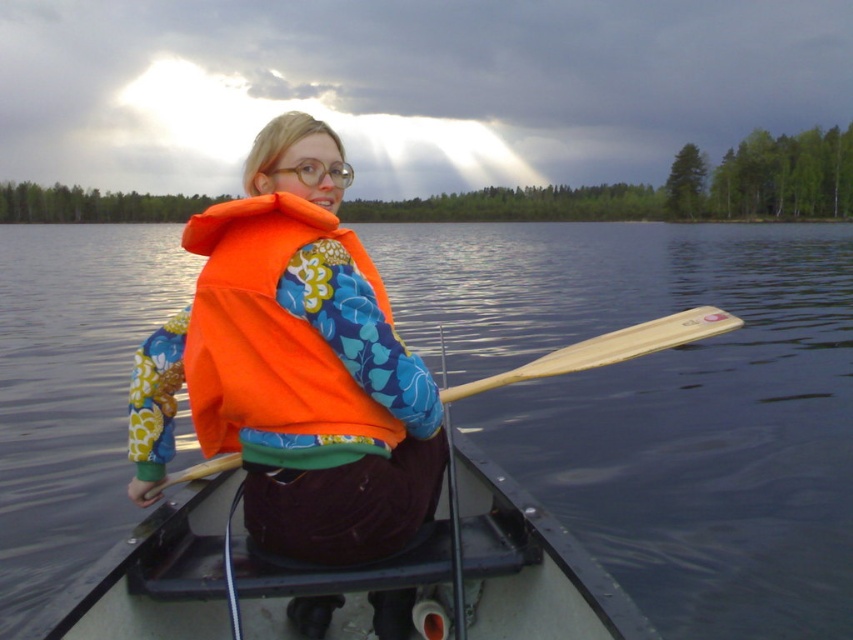
This screenshot has width=853, height=640. What do you see at coordinates (294, 365) in the screenshot?
I see `orange fabric life vest at center` at bounding box center [294, 365].

Who is positioned more to the left, orange fabric life vest at center or orange fleece life jacket at center?

From the viewer's perspective, orange fabric life vest at center appears more on the left side.

Is point (250, 173) behind point (248, 342)?

That is True.

At what (x,y) coordinates should I click in order to perform the action: click on orange fabric life vest at center. Please return your answer as a coordinate pair (x, y). This screenshot has height=640, width=853. Looking at the image, I should click on (294, 365).

Is point (254, 486) in front of point (462, 508)?

Yes.

Is orange fabric life vest at center below black plastic boat at center?

Actually, orange fabric life vest at center is above black plastic boat at center.

Between point (169, 451) and point (523, 522), which one is positioned in front?

Point (523, 522)

Where is `orange fabric life vest at center`? This screenshot has height=640, width=853. orange fabric life vest at center is located at coordinates (294, 365).

Can you confirm if transparent water at center is positioned to the left of black plastic boat at center?

Yes, transparent water at center is to the left of black plastic boat at center.

Is transparent water at center closer to camera compared to black plastic boat at center?

No, transparent water at center is behind black plastic boat at center.

Locate an element on the screen. The height and width of the screenshot is (640, 853). transparent water at center is located at coordinates (660, 403).

Where is `transparent water at center`? The image size is (853, 640). transparent water at center is located at coordinates (660, 403).